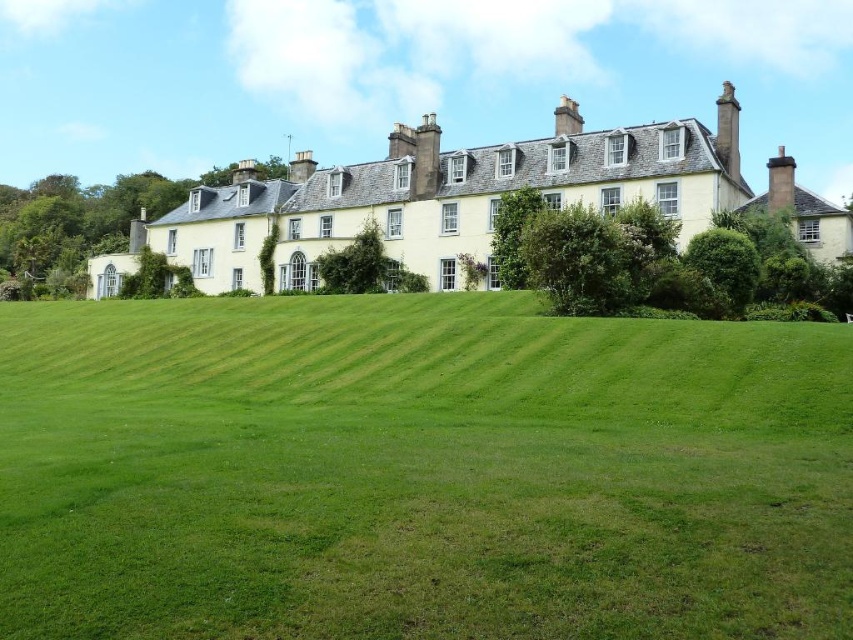
You are standing in front of the mansion and notice two points marked on the lawn. One is at coordinate point [560,577] and the other at point [814,246]. If you want to reach the point closer to you first, which coordinate should you head towards?

You should head towards point [560,577] because it is closer to the camera than point [814,246].

Based on the photo, you are a gardener planning to mow the lawn. You have a lawnmower that can only handle areas narrower than the yellow stone building at center. Can the green grass at center be mowed with this lawnmower?

The green grass at center has a lesser width compared to the yellow stone building at center. Since the lawnmower can handle areas narrower than the yellow stone building at center, the green grass at center can be mowed with this lawnmower.